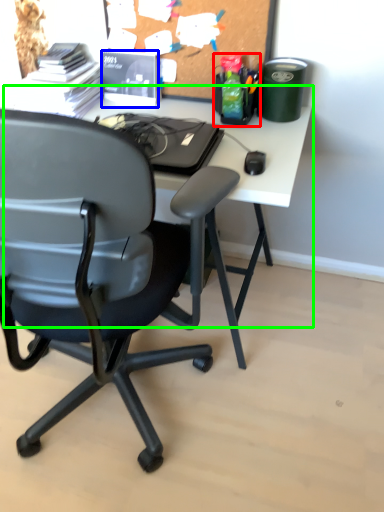
Question: Which object is the farthest from stationery (highlighted by a red box)? Choose among these: stationery (highlighted by a blue box) or computer desk (highlighted by a green box).

Choices:
 (A) stationery
 (B) computer desk

Answer: (A)